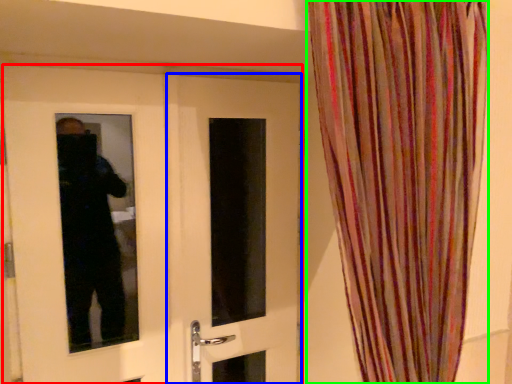
Question: Which object is positioned closest to door (highlighted by a red box)? Select from door (highlighted by a blue box) and curtain (highlighted by a green box).

Choices:
 (A) door
 (B) curtain

Answer: (A)